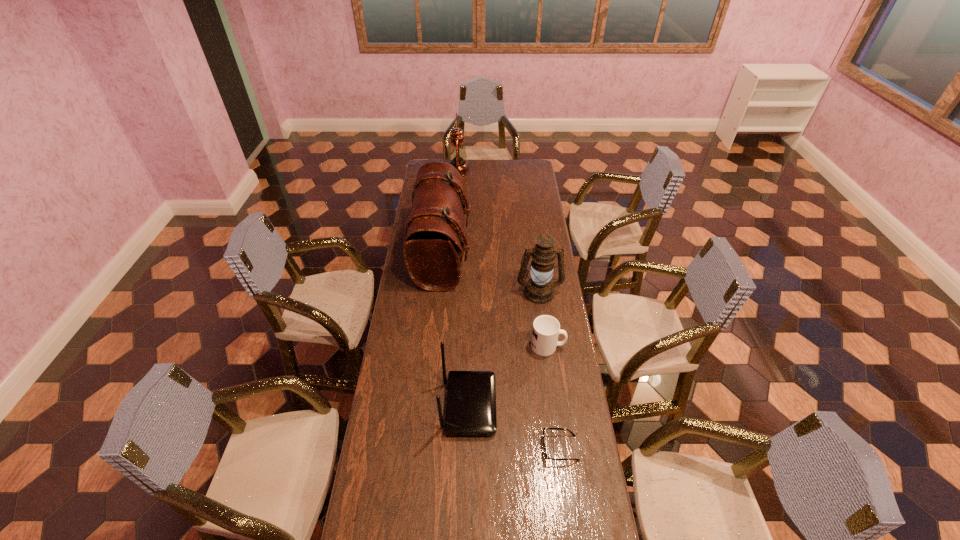
Locate an element on the screen. This screenshot has height=540, width=960. free space located on the front-facing side of the satchel is located at coordinates (538, 254).

Find the location of `vacant space located 0.070m on the front of the shorter oil lamp`. vacant space located 0.070m on the front of the shorter oil lamp is located at coordinates (542, 316).

Where is `vacant space located 0.170m on the front-facing side of the fourth tallest object`? vacant space located 0.170m on the front-facing side of the fourth tallest object is located at coordinates (542, 406).

This screenshot has height=540, width=960. In order to click on vacant space situated 0.270m on the lenses of the shortest object in this screenshot , I will do `click(464, 448)`.

At what (x,y) coordinates should I click in order to perform the action: click on vacant space located on the lenses of the shortest object. Please return your answer as a coordinate pair (x, y). Looking at the image, I should click on (484, 448).

This screenshot has width=960, height=540. I want to click on vacant space located 0.060m on the lenses of the shortest object, so click(x=525, y=448).

Image resolution: width=960 pixels, height=540 pixels. In order to click on object that is at the far edge in this screenshot , I will do `click(457, 155)`.

Image resolution: width=960 pixels, height=540 pixels. In order to click on oil lamp that is at the left edge in this screenshot , I will do `click(457, 155)`.

Locate an element on the screen. The height and width of the screenshot is (540, 960). satchel present at the left edge is located at coordinates (433, 241).

At what (x,y) coordinates should I click in order to perform the action: click on oil lamp at the right edge. Please return your answer as a coordinate pair (x, y). The image size is (960, 540). Looking at the image, I should click on (539, 289).